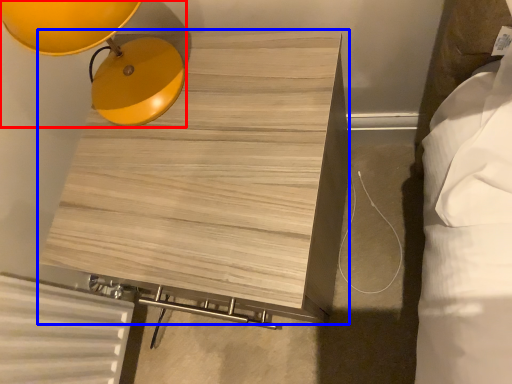
Question: Which point is closer to the camera, lamp (highlighted by a red box) or furniture (highlighted by a blue box)?

Choices:
 (A) lamp
 (B) furniture

Answer: (A)